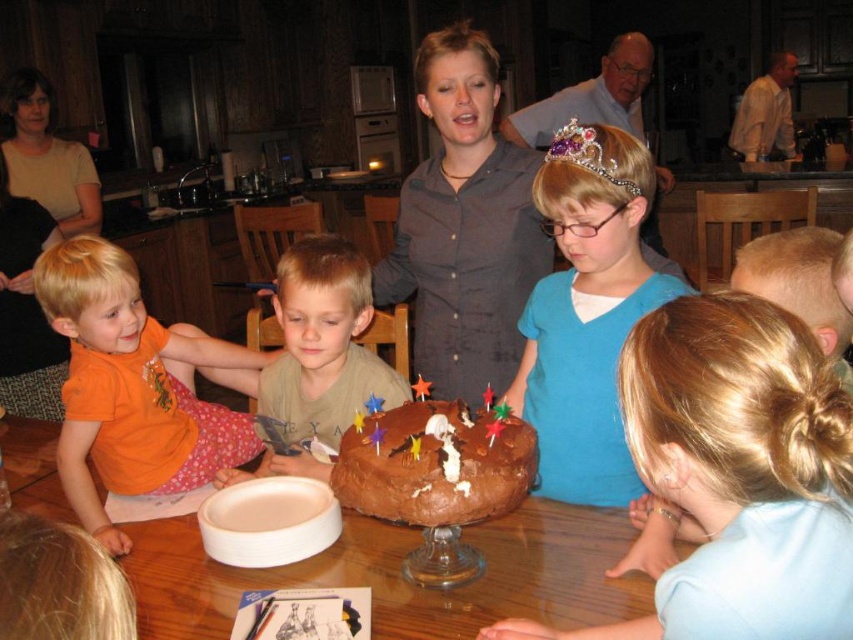
You are planning to place a rectangular gift box that is 20 cm long on the brown wooden table at center. The chocolatesmoothcake at center is already placed in the center of the table. Can the gift box be placed on the table without overlapping the cake?

The brown wooden table at center might be wider than chocolatesmoothcake at center. Since the cake is centered, there might be enough space on the edges of the table to place the gift box without overlapping it, provided the table has sufficient width. However, the exact dimensions are not specified, so this depends on the table being wider than the cake plus the length of the gift box.

You are standing at the point labeled as point (x=401, y=577) in the image. Which object are you currently standing on?

The point (x=401, y=577) is on the brown wooden table at center, so you are standing on the brown wooden table at center.

You are a child at the birthday party and want to blow out the candles on the brown matte cake at center. Since the brown wooden table at center is shorter than the cake, will you need to stand on something to reach the top of the cake?

The brown wooden table at center is not as tall as brown matte cake at center, so the cake is taller than the table. Therefore, you would need to stand on something to reach the top of the brown matte cake at center.